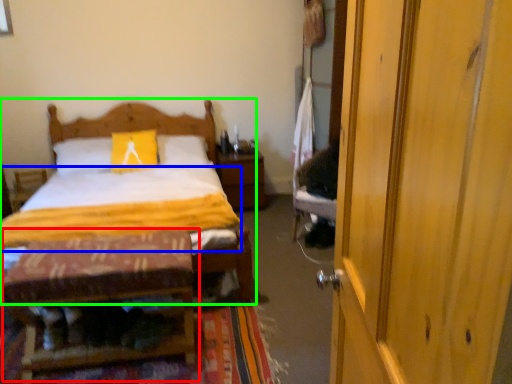
Question: Which object is positioned closest to table (highlighted by a red box)? Select from quilt (highlighted by a blue box) and bed (highlighted by a green box).

Choices:
 (A) quilt
 (B) bed

Answer: (A)